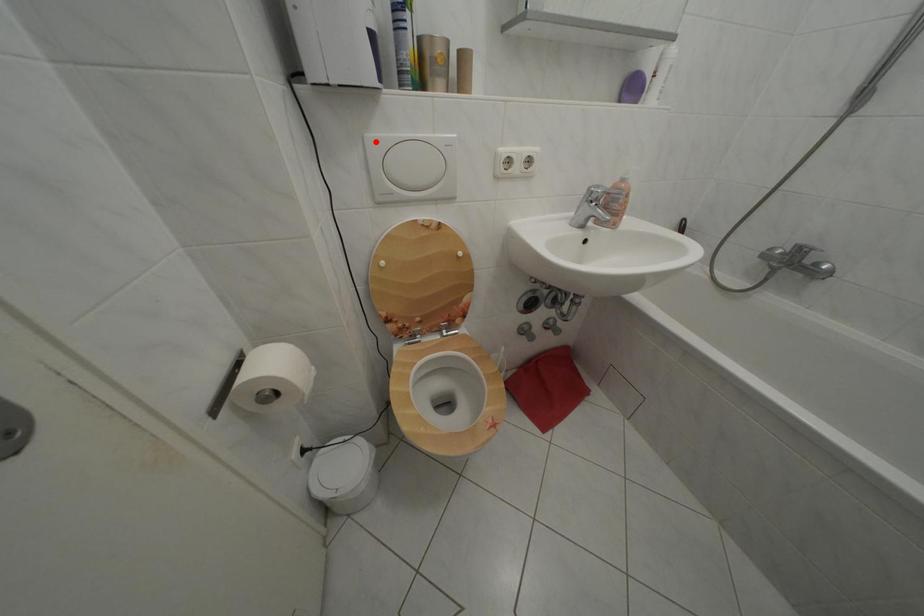
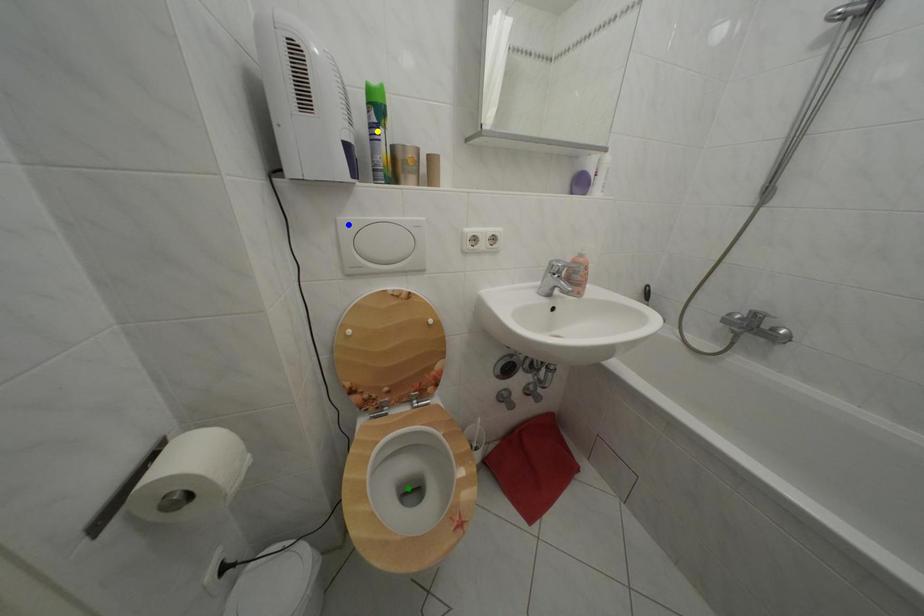
Question: I am providing you with two images of the same scene from different viewpoints. A red point is marked on the first image. You are given multiple points on the second image. Can you choose the point in image 2 that corresponds to the point in image 1?

Choices:
 (A) blue point
 (B) yellow point
 (C) green point

Answer: (A)